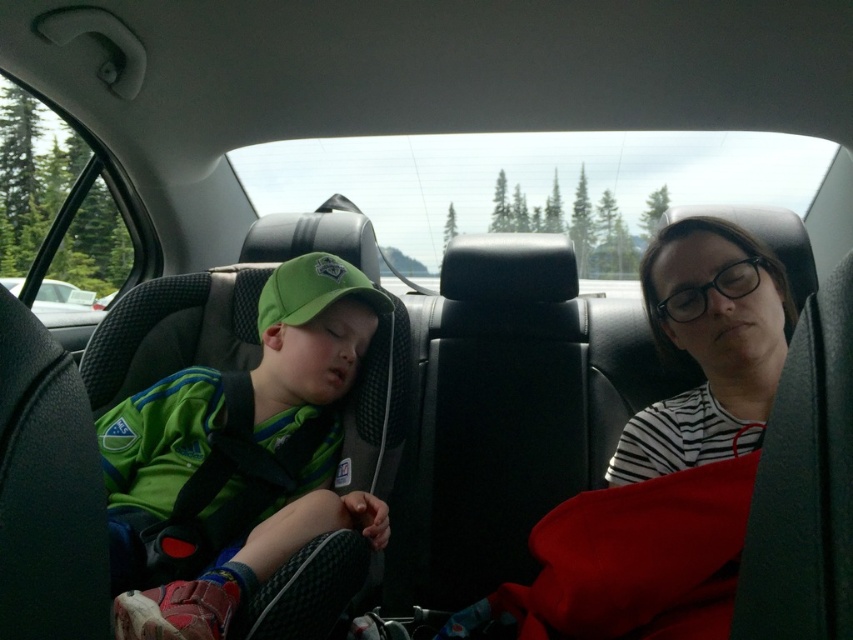
You are a photographer standing in the backseat of the car. You want to take a photo of the green matte baseball cap at left without moving any objects. Can you capture the entire cap in your camera frame if your camera has a minimum focus distance of 36 inches?

The distance between the green matte baseball cap at left and the camera is 38.34 inches, which is greater than the camera minimum focus distance of 36 inches. Therefore, the photographer can capture the entire cap in the camera frame.

You are sitting in the backseat of the car and want to reach the point at coordinates (767, 333). Considering your arm length is 2.3 feet, can you comfortably reach that point without stretching too much?

The point at coordinates (767, 333) is 4.63 feet away from the viewer. Since your arm length is only 2.3 feet, you cannot comfortably reach that point without stretching too much.